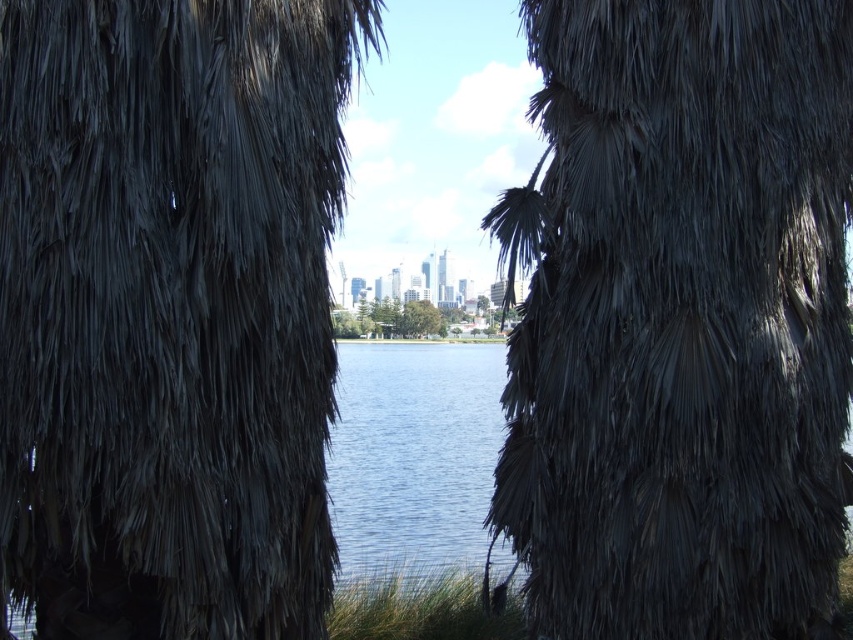
You are standing in front of the two trees, dark brown textured palm tree at center and green leafy tree at center. Which tree would block your view of the city skyline if you were to stand directly in front of them?

The dark brown textured palm tree at center is closer to the viewer than the green leafy tree at center, so it would block your view of the city skyline first.

You are an architect designing a new park and want to include both the dark brown textured palm tree at center and the green leafy tree at center. Since space is limited, which tree should you prioritize planting to ensure there is enough room for both?

The dark brown textured palm tree at center is larger in size than the green leafy tree at center, so you should prioritize planting the green leafy tree at center first to save space for the larger palm tree.

You are a photographer planning to capture the reflection of the dark gray textured palm tree at center in the blue water at center. Based on the scene, will the palm tree be visible in the water?

The dark gray textured palm tree at center is above blue water at center, so its reflection should be visible in the water.